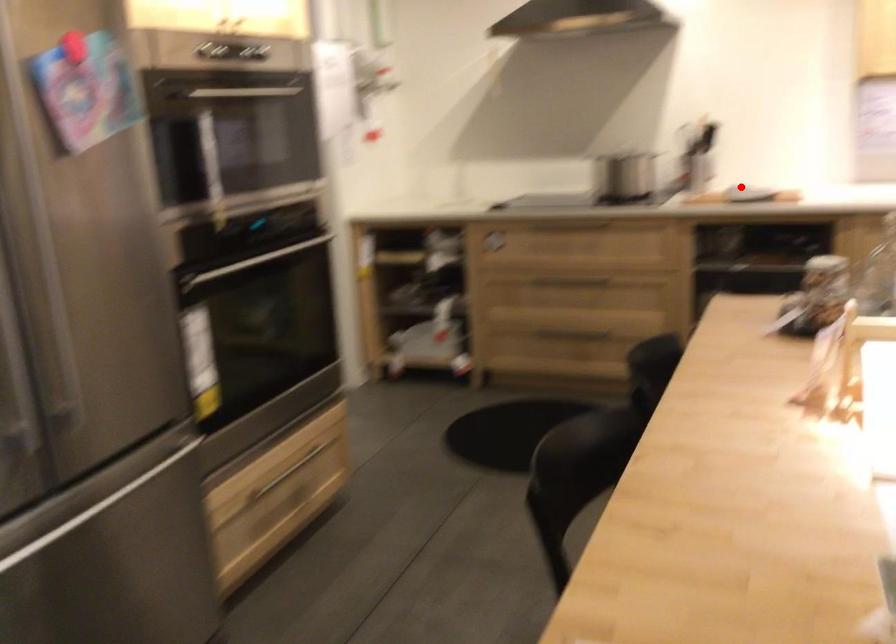
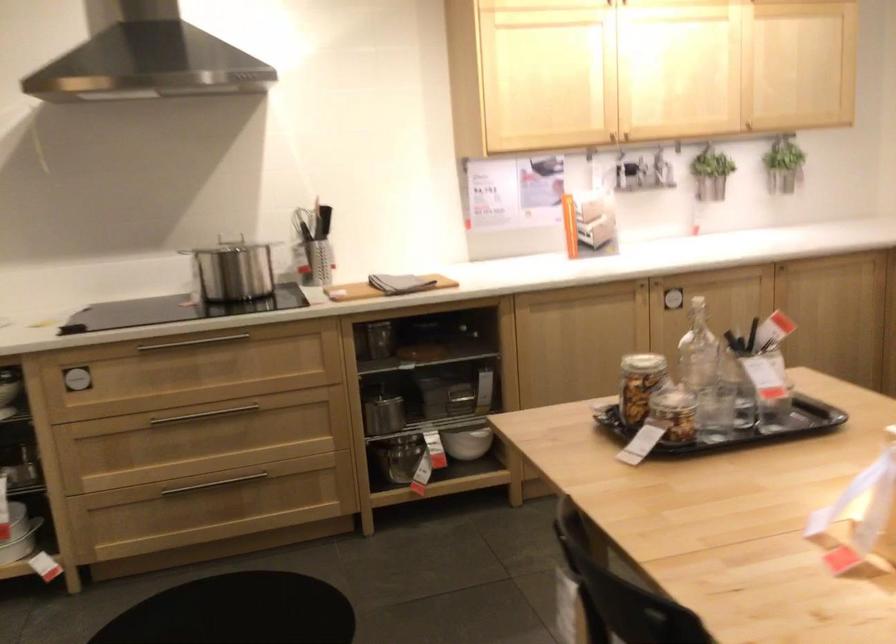
Question: I am providing you with two images of the same scene from different viewpoints. Image1 has a red point marked. In image2, the corresponding 3D location appears at what relative position? Reply with the corresponding letter.

Choices:
 (A) Closer
 (B) Farther

Answer: (A)